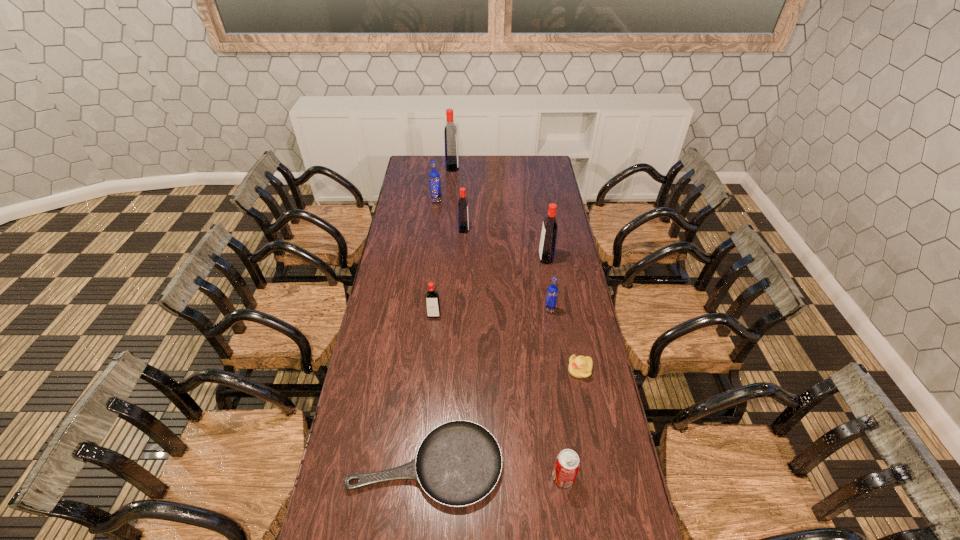
Locate an element on the screen. object that is at the left edge is located at coordinates (458, 463).

You are a GUI agent. You are given a task and a screenshot of the screen. Output one action in this format:
    pyautogui.click(x=<x>, y=<y>)
    Task: Click on the soda can that is positioned at the right edge
    The height and width of the screenshot is (540, 960).
    Given the screenshot: What is the action you would take?
    pos(567,464)

Image resolution: width=960 pixels, height=540 pixels. Find the location of `duckling that is at the right edge`. duckling that is at the right edge is located at coordinates (579, 367).

The height and width of the screenshot is (540, 960). Find the location of `vacant region at the far edge of the desktop`. vacant region at the far edge of the desktop is located at coordinates (465, 168).

The height and width of the screenshot is (540, 960). In the image, there is a desktop. What are the coordinates of `vacant space at the left edge` in the screenshot? It's located at (357, 525).

The width and height of the screenshot is (960, 540). I want to click on blank space at the right edge of the desktop, so click(x=598, y=361).

Where is `vacant area at the far left corner of the desktop`? This screenshot has width=960, height=540. vacant area at the far left corner of the desktop is located at coordinates (405, 174).

Locate an element on the screen. free space between the second biggest red vodka and the third farthest object is located at coordinates (505, 244).

Image resolution: width=960 pixels, height=540 pixels. What are the coordinates of `empty space that is in between the fifth nearest vodka and the seventh tallest object` in the screenshot? It's located at (500, 339).

Identify the location of free space between the seventh tallest object and the smallest red vodka. (499, 396).